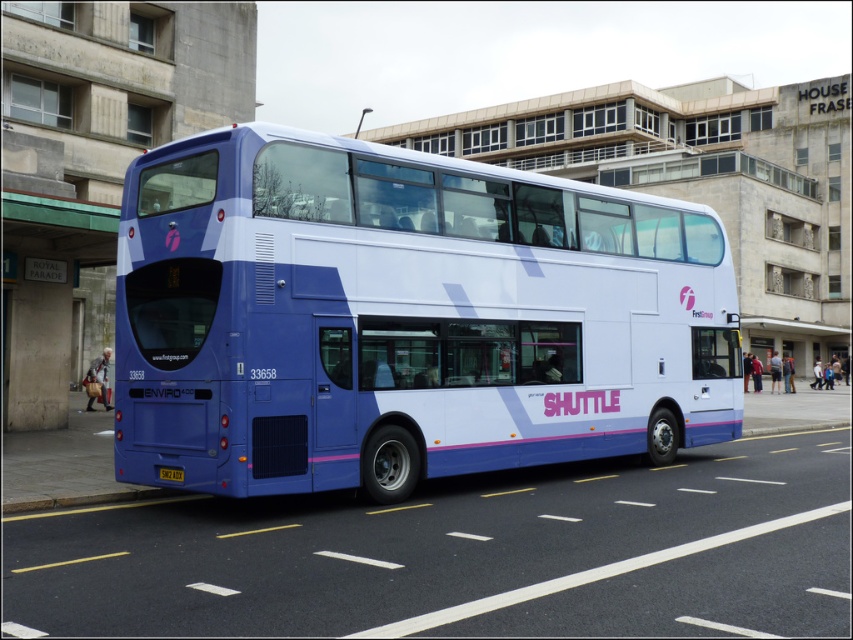
Can you confirm if blue metallic/decorative bus at center is wider than yellow metallic license plate at rear center?

Yes.

Who is shorter, blue metallic/decorative bus at center or yellow metallic license plate at rear center?

yellow metallic license plate at rear center is shorter.

Identify the location of blue metallic/decorative bus at center. (404, 317).

Which is in front, point (207, 164) or point (42, 289)?

Point (207, 164) is in front.

The width and height of the screenshot is (853, 640). What do you see at coordinates (404, 317) in the screenshot?
I see `blue metallic/decorative bus at center` at bounding box center [404, 317].

The height and width of the screenshot is (640, 853). I want to click on blue metallic/decorative bus at center, so click(404, 317).

Looking at this image, can you confirm if green concrete bus stop at lower left is bigger than yellow metallic license plate at rear center?

Correct, green concrete bus stop at lower left is larger in size than yellow metallic license plate at rear center.

Between point (100, 228) and point (170, 476), which one is positioned in front?

Point (170, 476) is more forward.

What do you see at coordinates (44, 298) in the screenshot?
I see `green concrete bus stop at lower left` at bounding box center [44, 298].

Find the location of `green concrete bus stop at lower left`. green concrete bus stop at lower left is located at coordinates (44, 298).